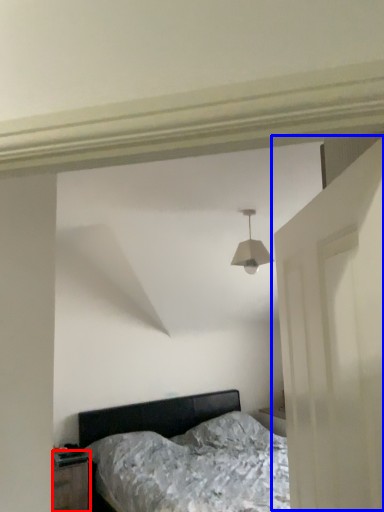
Question: Which object appears farthest to the camera in this image, nightstand (highlighted by a red box) or door (highlighted by a blue box)?

Choices:
 (A) nightstand
 (B) door

Answer: (A)